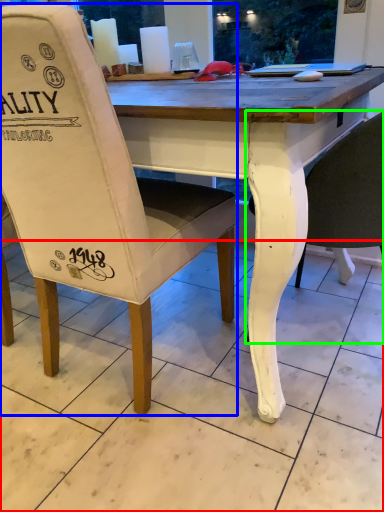
Question: Which object is the closest to the tile (highlighted by a red box)? Choose among these: chair (highlighted by a blue box) or chair (highlighted by a green box).

Choices:
 (A) chair
 (B) chair

Answer: (A)